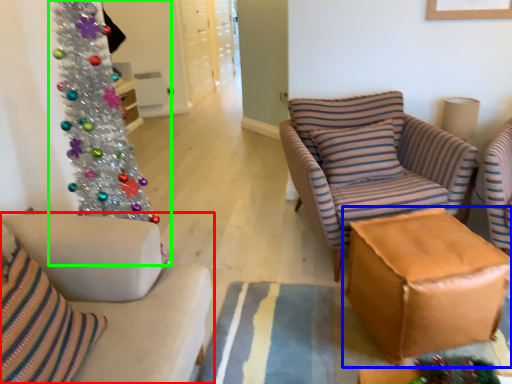
Question: Estimate the real-world distances between objects in this image. Which object is farther from studio couch (highlighted by a red box), table (highlighted by a blue box) or christmas tree (highlighted by a green box)?

Choices:
 (A) table
 (B) christmas tree

Answer: (A)